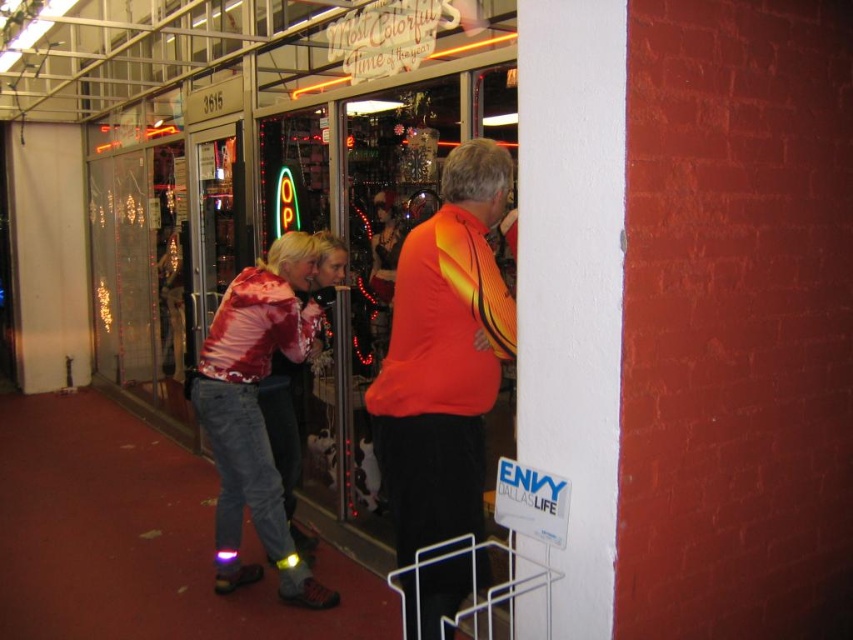
Question: Is orange jersey at center bigger than shiny red jacket at center?

Choices:
 (A) yes
 (B) no

Answer: (B)

Question: Among these objects, which one is nearest to the camera?

Choices:
 (A) orange jersey at center
 (B) shiny red jacket at center

Answer: (A)

Question: Is orange jersey at center positioned before shiny red jacket at center?

Choices:
 (A) no
 (B) yes

Answer: (B)

Question: Which point is farther to the camera?

Choices:
 (A) (450, 278)
 (B) (257, 372)

Answer: (B)

Question: Is orange jersey at center to the right of shiny red jacket at center from the viewer's perspective?

Choices:
 (A) no
 (B) yes

Answer: (B)

Question: Which point is closer to the camera taking this photo?

Choices:
 (A) (276, 554)
 (B) (503, 336)

Answer: (B)